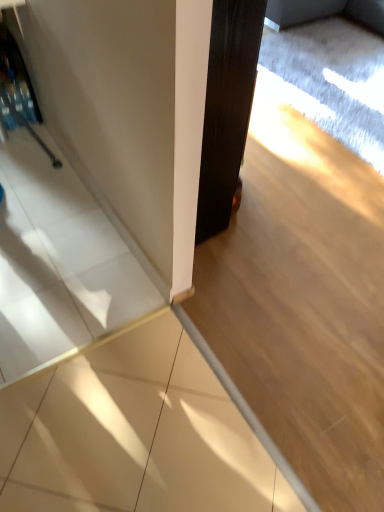
What do you see at coordinates (227, 108) in the screenshot?
I see `white matte door at center` at bounding box center [227, 108].

Identify the location of white matte door at center. (227, 108).

At what (x,y) coordinates should I click in order to perform the action: click on white matte door at center. Please return your answer as a coordinate pair (x, y). Looking at the image, I should click on (227, 108).